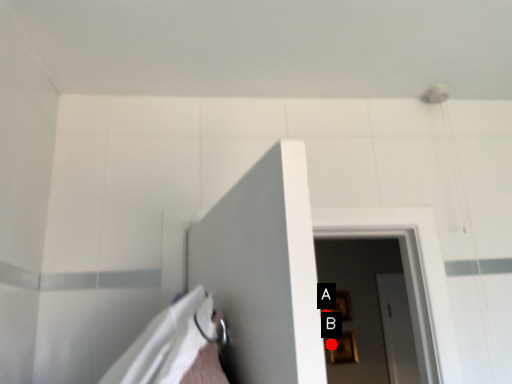
Question: Two points are circled on the image, labeled by A and B beside each circle. Which point is further to the camera?

Choices:
 (A) A is further
 (B) B is further

Answer: (A)